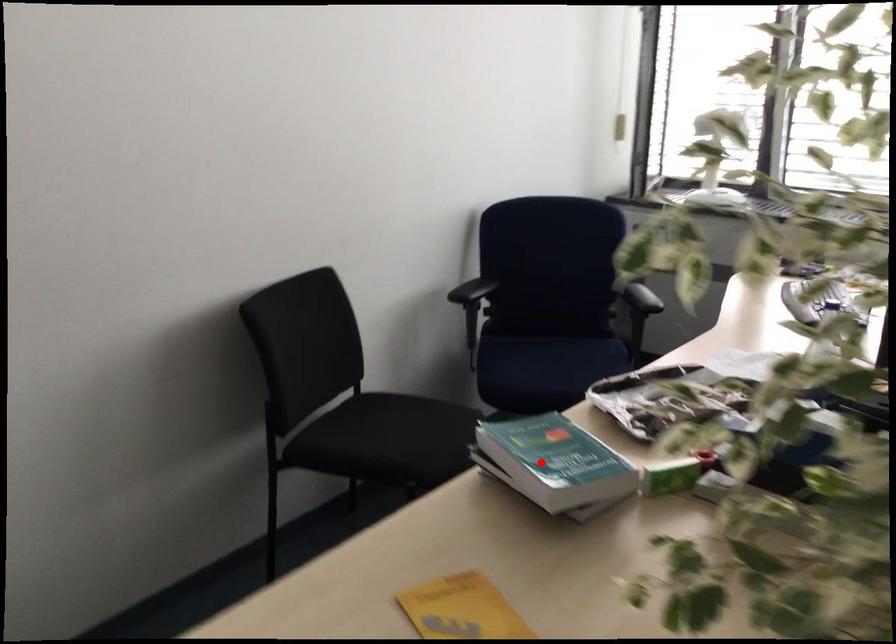
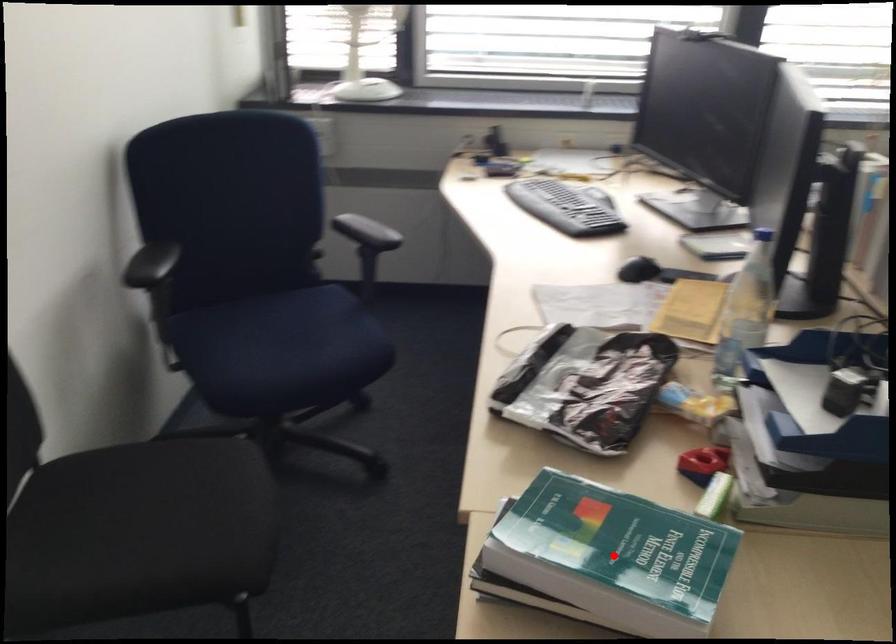
I am providing you with two images of the same scene from different viewpoints. A red point is marked on the first image and another point is marked on the second image. Are the points marked in image1 and image2 representing the same 3D position?

Yes